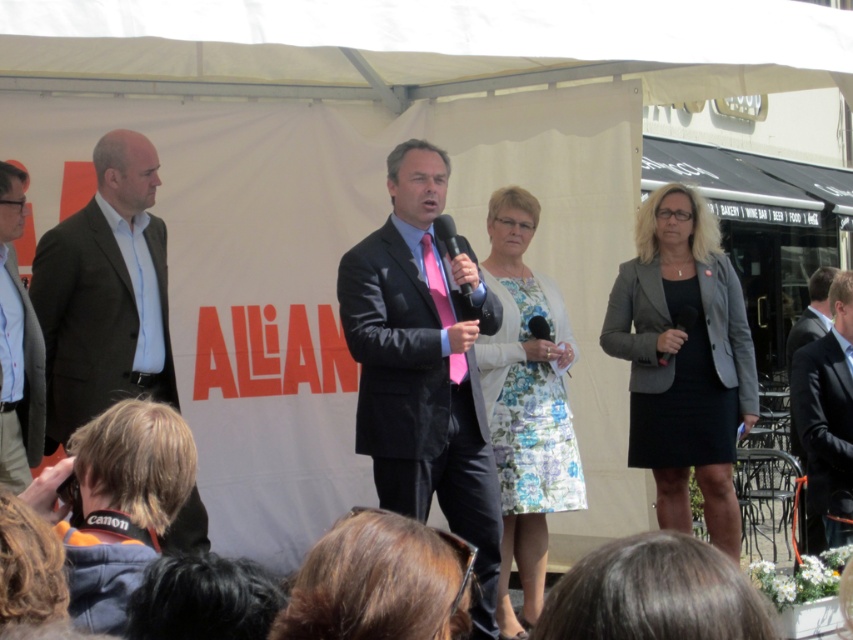
The floral fabric dress at center is located at coordinates point (526, 404). If the stage is represented by a coordinate system where the bottom left corner is 0,0 and the top right corner is 1,1, what is the position of the floral fabric dress at center relative to the stage?

The floral fabric dress at center is located at coordinates point (526, 404) on the stage, which places it near the center of the stage since the coordinates are close to 0.5,0.5.

What is located at the coordinates point [105,292]?

The dark brown suit at left is located at point [105,292].